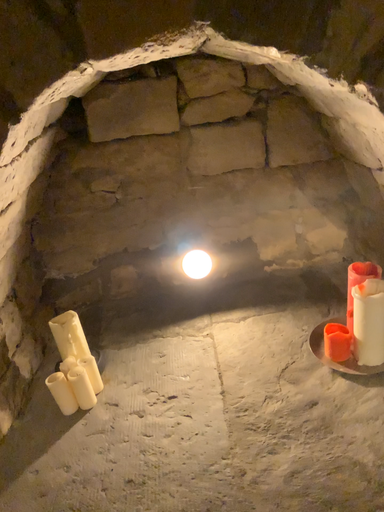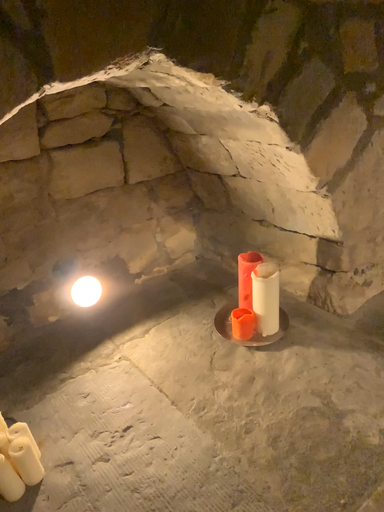
Question: How did the camera likely rotate when shooting the video?

Choices:
 (A) rotated left
 (B) rotated right

Answer: (B)